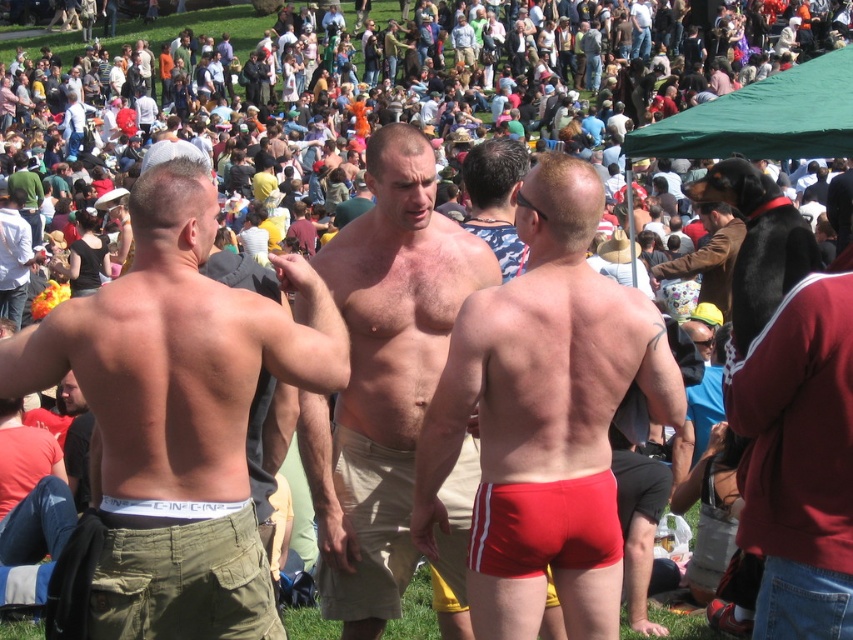
Question: Does white matte underwear at center have a larger size compared to red fabric jacket at right?

Choices:
 (A) no
 (B) yes

Answer: (B)

Question: Where is white matte underwear at center located in relation to tan khaki shorts at center in the image?

Choices:
 (A) above
 (B) below

Answer: (B)

Question: Which object appears closest to the camera in this image?

Choices:
 (A) red fabric jacket at right
 (B) tan khaki shorts at center
 (C) white matte underwear at center
 (D) green fabric canopy at upper right

Answer: (C)

Question: Which point appears closest to the camera in this image?

Choices:
 (A) (431, 352)
 (B) (833, 435)
 (C) (706, 141)

Answer: (B)

Question: Can you confirm if green fabric canopy at upper right is positioned to the right of red smooth boxer shorts at lower center?

Choices:
 (A) yes
 (B) no

Answer: (A)

Question: Estimate the real-world distances between objects in this image. Which object is closer to the tan khaki shorts at center?

Choices:
 (A) red matte boxer shorts at center
 (B) red fabric jacket at right

Answer: (A)